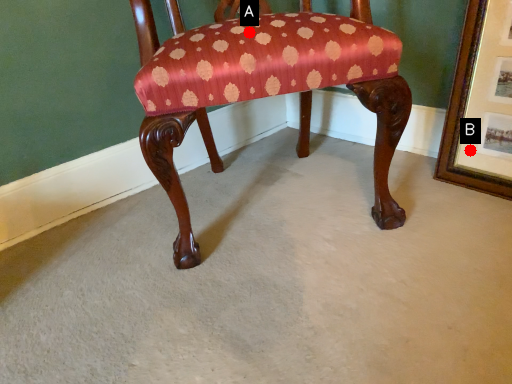
Question: Two points are circled on the image, labeled by A and B beside each circle. Which of the following is the closest to the observer?

Choices:
 (A) A is closer
 (B) B is closer

Answer: (A)